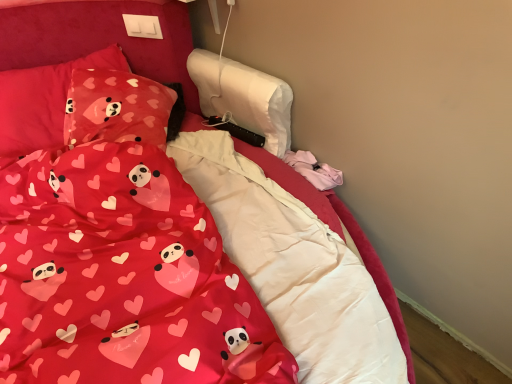
Question: Should I look upward or downward to see matte red fabric at center?

Choices:
 (A) down
 (B) up

Answer: (A)

Question: Is matte fabric pillow at upper left, which is the second pillow in left-to-right order, oriented towards matte pink fabric pillow at upper left, the 1th pillow viewed from the left?

Choices:
 (A) no
 (B) yes

Answer: (B)

Question: Considering the relative sizes of matte fabric pillow at upper left, which is the second pillow in left-to-right order, and matte pink fabric pillow at upper left, the 1th pillow viewed from the left, in the image provided, is matte fabric pillow at upper left, which is the second pillow in left-to-right order, taller than matte pink fabric pillow at upper left, the 1th pillow viewed from the left,?

Choices:
 (A) no
 (B) yes

Answer: (A)

Question: Is matte fabric pillow at upper left, which is the second pillow in left-to-right order, oriented away from matte pink fabric pillow at upper left, the 1th pillow viewed from the left?

Choices:
 (A) no
 (B) yes

Answer: (B)

Question: From the image's perspective, is matte fabric pillow at upper left, which appears as the 1th pillow when viewed from the right, below matte pink fabric pillow at upper left, which is the second pillow in right-to-left order?

Choices:
 (A) yes
 (B) no

Answer: (A)

Question: Can you confirm if matte fabric pillow at upper left, which is the second pillow in left-to-right order, is bigger than matte pink fabric pillow at upper left, which is the second pillow in right-to-left order?

Choices:
 (A) no
 (B) yes

Answer: (A)

Question: Is the depth of matte fabric pillow at upper left, which is the second pillow in left-to-right order, greater than that of matte pink fabric pillow at upper left, the 1th pillow viewed from the left?

Choices:
 (A) yes
 (B) no

Answer: (B)

Question: Is matte fabric pillow at upper left, which appears as the 1th pillow when viewed from the right, turned away from matte red fabric at center?

Choices:
 (A) no
 (B) yes

Answer: (A)

Question: Is matte fabric pillow at upper left, which appears as the 1th pillow when viewed from the right, facing towards matte red fabric at center?

Choices:
 (A) no
 (B) yes

Answer: (B)

Question: Can you confirm if matte fabric pillow at upper left, which is the second pillow in left-to-right order, is thinner than matte red fabric at center?

Choices:
 (A) yes
 (B) no

Answer: (A)

Question: Is matte fabric pillow at upper left, which appears as the 1th pillow when viewed from the right, completely or partially outside of matte red fabric at center?

Choices:
 (A) yes
 (B) no

Answer: (A)

Question: From a real-world perspective, is matte fabric pillow at upper left, which appears as the 1th pillow when viewed from the right, beneath matte red fabric at center?

Choices:
 (A) yes
 (B) no

Answer: (A)

Question: Does matte fabric pillow at upper left, which appears as the 1th pillow when viewed from the right, lie behind matte red fabric at center?

Choices:
 (A) no
 (B) yes

Answer: (B)

Question: Does matte pink fabric pillow at upper left, which is the second pillow in right-to-left order, have a lesser width compared to matte fabric pillow at upper left, which appears as the 1th pillow when viewed from the right?

Choices:
 (A) no
 (B) yes

Answer: (A)